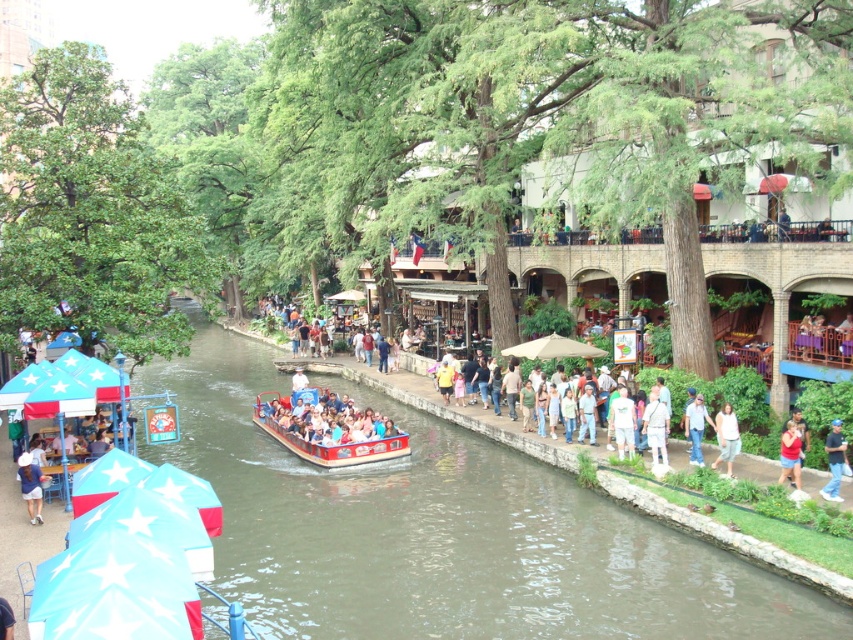
Question: Which point appears farthest from the camera in this image?

Choices:
 (A) (798, 467)
 (B) (703, 428)
 (C) (630, 419)

Answer: (C)

Question: Which point appears farthest from the camera in this image?

Choices:
 (A) (694, 426)
 (B) (837, 470)
 (C) (323, 536)

Answer: (A)

Question: Where is white cotton shirt at lower right located in relation to blue denim jeans at lower right in the image?

Choices:
 (A) right
 (B) left

Answer: (B)

Question: Which of the following is the closest to the observer?

Choices:
 (A) (622, 404)
 (B) (730, 472)

Answer: (B)

Question: Does brown smooth water at center appear under red cotton shirt at lower right?

Choices:
 (A) no
 (B) yes

Answer: (B)

Question: Is wooden polished boat at center wider than white cotton shirt at center?

Choices:
 (A) yes
 (B) no

Answer: (A)